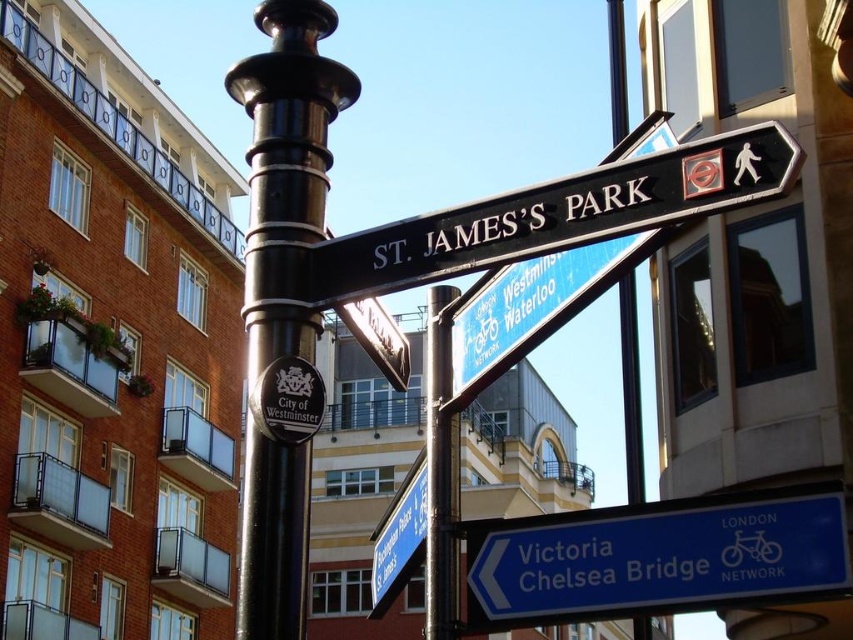
You are a cyclist approaching the signpost and need to choose between the blue plastic sign at lower right and the blue plastic street sign at lower center. Which one is nearer to you?

The blue plastic sign at lower right is closer to the viewer than the blue plastic street sign at lower center, so you should choose the blue plastic sign at lower right as it is nearer.